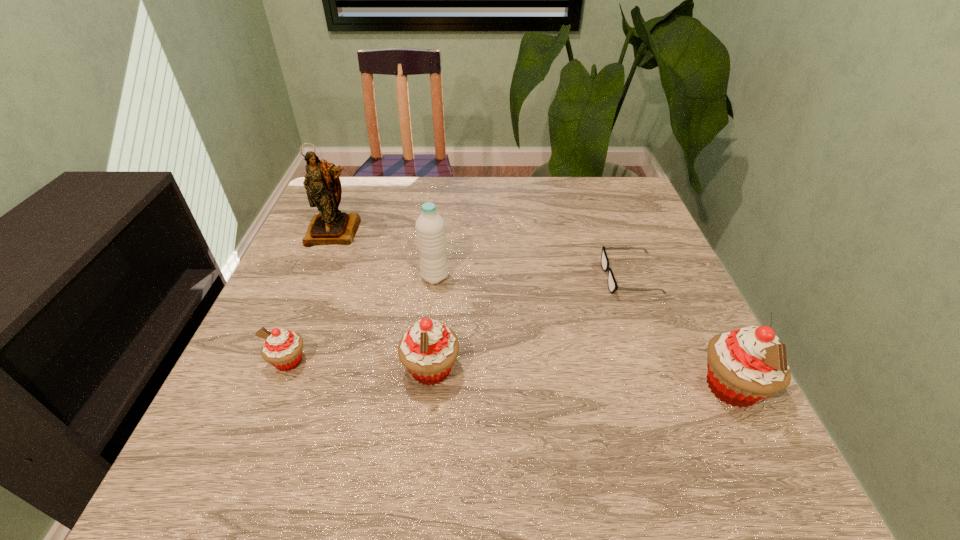
Locate an element on the screen. This screenshot has width=960, height=540. cupcake that is at the right edge is located at coordinates (747, 365).

Locate an element on the screen. This screenshot has height=540, width=960. spectacles present at the right edge is located at coordinates (612, 284).

I want to click on object located in the far left corner section of the desktop, so click(x=331, y=226).

This screenshot has width=960, height=540. I want to click on object that is at the near right corner, so click(747, 365).

Where is `blank space at the far edge of the desktop`? blank space at the far edge of the desktop is located at coordinates (379, 210).

Image resolution: width=960 pixels, height=540 pixels. In the image, there is a desktop. In order to click on free region at the left edge in this screenshot , I will do `click(297, 306)`.

Identify the location of free space at the right edge. (649, 365).

In order to click on free space at the far left corner in this screenshot , I will do `click(371, 194)`.

Locate an element on the screen. The width and height of the screenshot is (960, 540). free area in between the shortest object and the water bottle is located at coordinates (532, 278).

Locate an element on the screen. The width and height of the screenshot is (960, 540). unoccupied position between the rightmost cupcake and the spectacles is located at coordinates (681, 333).